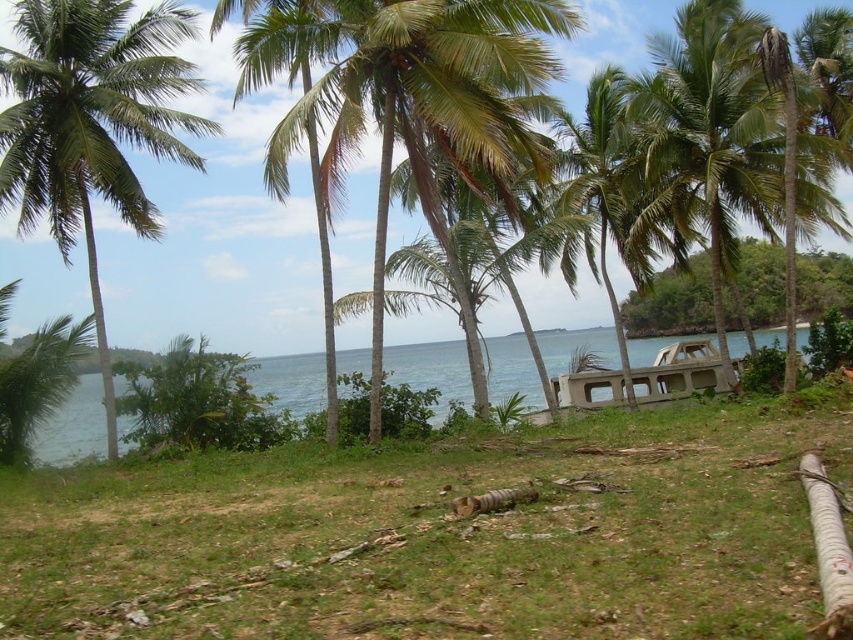
You are standing on the beach and see the green leafy palm tree at left and the blue water at center. Which object is closer to you?

The green leafy palm tree at left is closer to you than the blue water at center because it is further to the viewer.

You are standing on the grassy area in the foreground of the tropical coastal scene. You need to reach the blue water at center without getting your feet wet. Can you walk around the green leafy palm tree at left to do so?

The green leafy palm tree at left is positioned over blue water at center, so walking around it might still lead you towards the water. To avoid getting wet, you should find another path that doesn